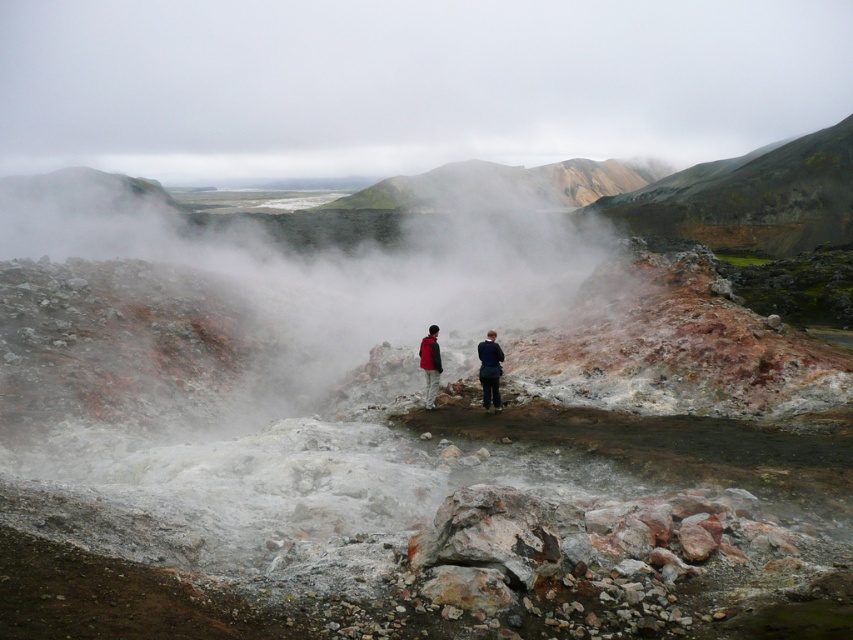
Which is more to the left, white fog at center or rustic volcanic rock at upper center?

From the viewer's perspective, white fog at center appears more on the left side.

Does point (447, 192) lie behind point (473, 189)?

No, (447, 192) is closer to viewer.

Between point (207, 323) and point (599, 195), which one is positioned behind?

The point (599, 195) is more distant.

You are a GUI agent. You are given a task and a screenshot of the screen. Output one action in this format:
    pyautogui.click(x=<x>, y=<y>)
    Task: Click on the white fog at center
    The width and height of the screenshot is (853, 640).
    Given the screenshot: What is the action you would take?
    tap(270, 289)

Can you confirm if white fog at upper center is wider than dark blue fabric jacket at center?

Yes, white fog at upper center is wider than dark blue fabric jacket at center.

Is white fog at upper center to the right of dark blue fabric jacket at center from the viewer's perspective?

No, white fog at upper center is not to the right of dark blue fabric jacket at center.

In order to click on white fog at upper center in this screenshot , I will do `click(407, 83)`.

In order to click on white fog at upper center in this screenshot , I will do `click(407, 83)`.

Who is positioned more to the right, matte red jacket at center or red jacket at center?

matte red jacket at center is more to the right.

Is matte red jacket at center bigger than red jacket at center?

Actually, matte red jacket at center might be smaller than red jacket at center.

Which is behind, point (494, 372) or point (434, 333)?

The point (434, 333) is behind.

Where is `matte red jacket at center`? Image resolution: width=853 pixels, height=640 pixels. matte red jacket at center is located at coordinates (490, 369).